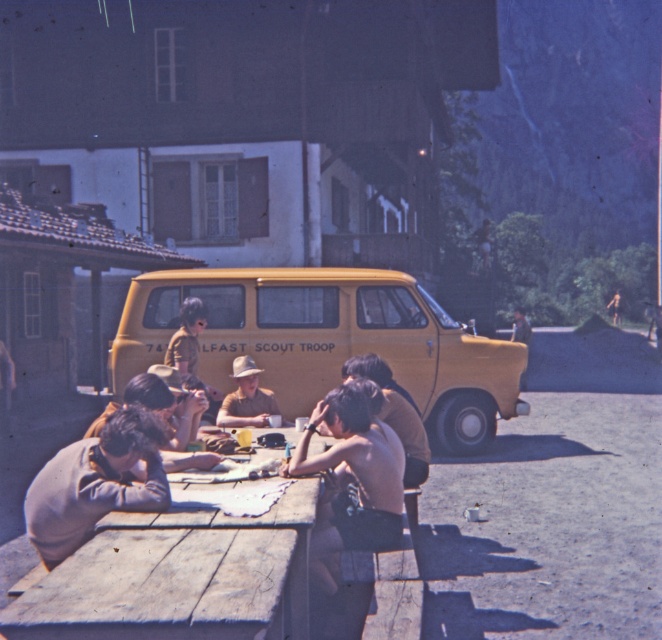
Question: Is yellow matte van at center smaller than light brown sweater at lower left?

Choices:
 (A) no
 (B) yes

Answer: (A)

Question: Which of the following is the closest to the observer?

Choices:
 (A) light brown sweater at lower left
 (B) shiny brown shorts at center
 (C) wooden table at lower center

Answer: (C)

Question: Which object appears closest to the camera in this image?

Choices:
 (A) matte khaki hat at center
 (B) shiny brown shorts at center
 (C) yellow matte van at center

Answer: (B)

Question: Can you confirm if yellow matte van at center is wider than matte khaki hat at center?

Choices:
 (A) yes
 (B) no

Answer: (A)

Question: Where is wooden table at lower center located in relation to matte khaki hat at center in the image?

Choices:
 (A) right
 (B) left

Answer: (A)

Question: Based on their relative distances, which object is nearer to the yellow matte van at center?

Choices:
 (A) shiny brown shorts at center
 (B) matte khaki hat at center
 (C) light brown sweater at lower left

Answer: (B)